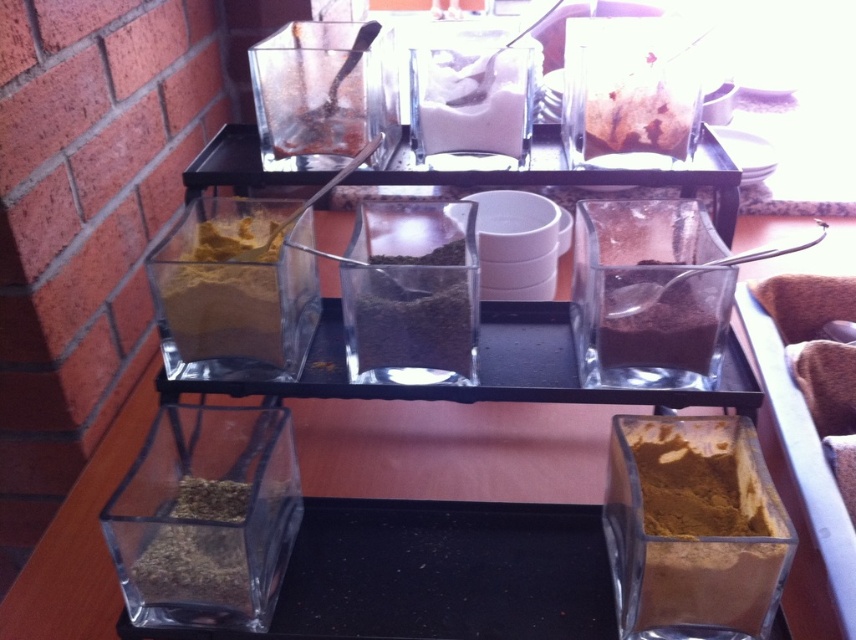
Question: Which object appears closest to the camera in this image?

Choices:
 (A) brown crumbly spice at center
 (B) white powder at center

Answer: (A)

Question: Which of the following is the farthest from the observer?

Choices:
 (A) (242, 524)
 (B) (614, 147)
 (C) (605, 332)

Answer: (B)

Question: Which object is farther from the camera taking this photo?

Choices:
 (A) clear glass spice container at lower left
 (B) dark green granular spice at center
 (C) dark brown powder at center
 (D) yellow powder at bottom right

Answer: (B)

Question: Can you confirm if clear glass spice container at lower left is wider than green herb at lower left?

Choices:
 (A) no
 (B) yes

Answer: (B)

Question: Is clear glass spice container at lower left positioned at the back of dark brown powder at center?

Choices:
 (A) no
 (B) yes

Answer: (A)

Question: In this image, where is white powder at center located relative to dark brown powder at center?

Choices:
 (A) left
 (B) right

Answer: (A)